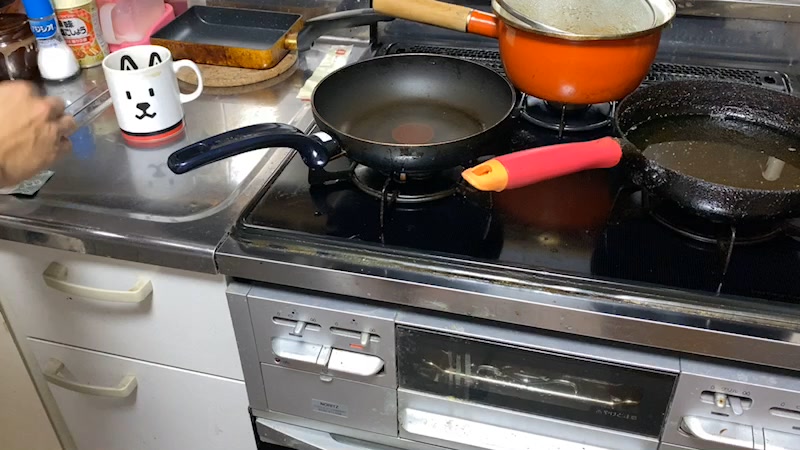
In order to click on handles on drawers in this screenshot , I will do [x=130, y=392], [x=86, y=295].